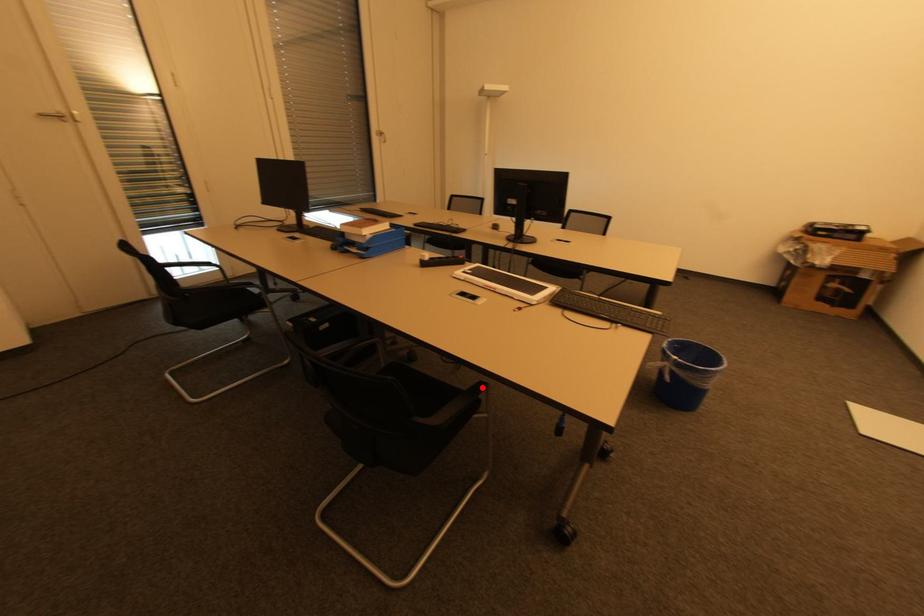
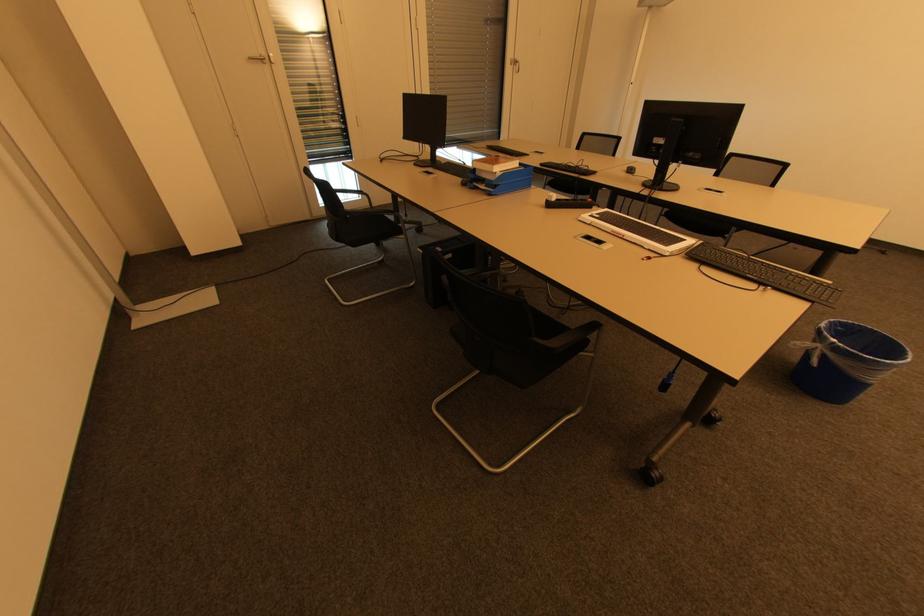
In the second image, find the point that corresponds to the highlighted location in the first image.

(598, 326)